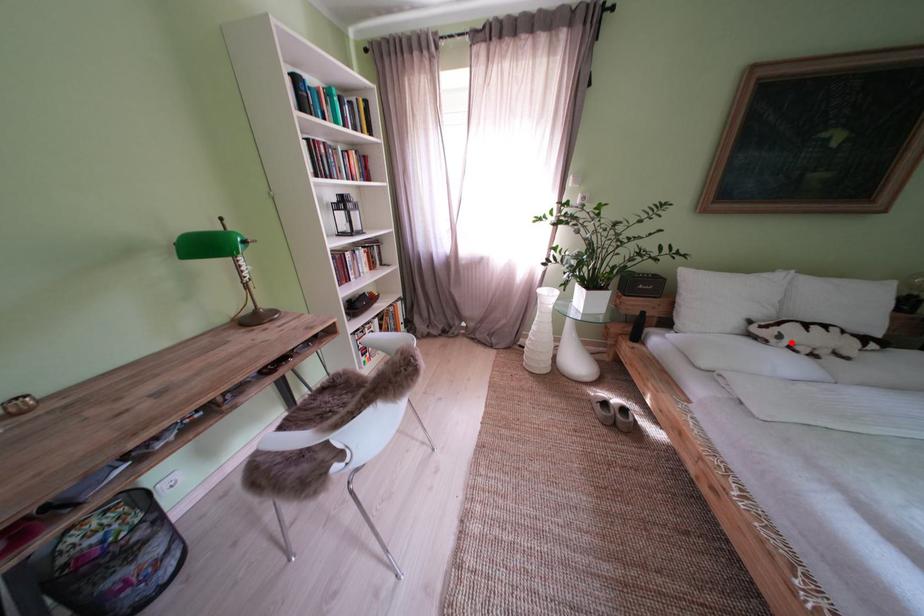
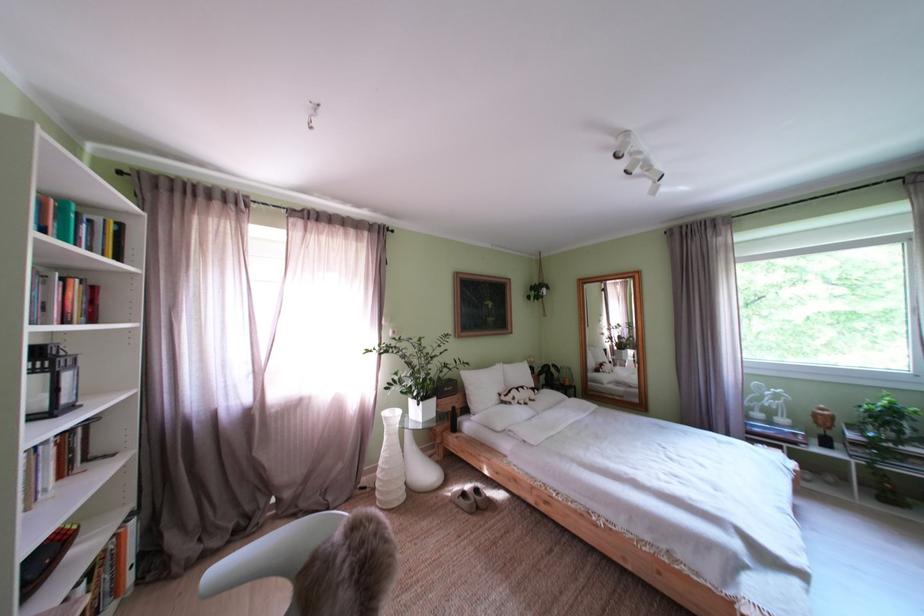
The point at the highlighted location is marked in the first image. Where is the corresponding point in the second image?

(525, 405)